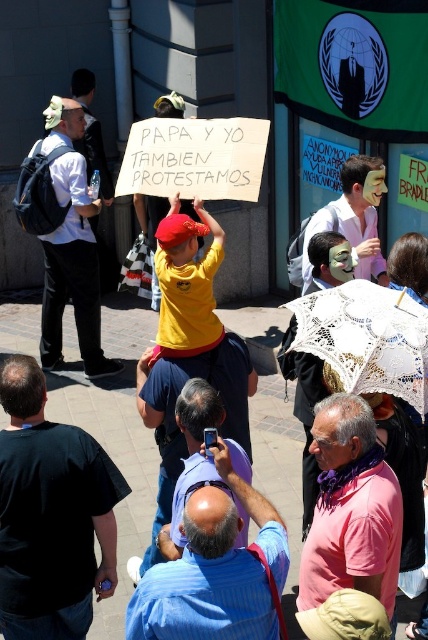
You are standing at the point labeled point (101, 180) and want to walk towards the point labeled point (326, 547). Which direction should you move?

You should move forward because point (326, 547) is in front of point (101, 180).

You are a participant in the protest and you see two points marked in the scene. The first point is at coordinate point (382, 172) and the second is at point (85, 131). Which point is closer to you as you stand at the front of the protest area?

Point (382, 172) is in front of point (85, 131), so the first point is closer to you.

You are a photographer at the protest scene. You want to take a photo that includes both the white matte mask at center and the white shirt at center. Which object should you focus on first if you want to ensure both are in frame without moving the camera?

The white matte mask at center has a lesser height compared to the white shirt at center, so you should focus on the white shirt at center first to ensure both are in frame.